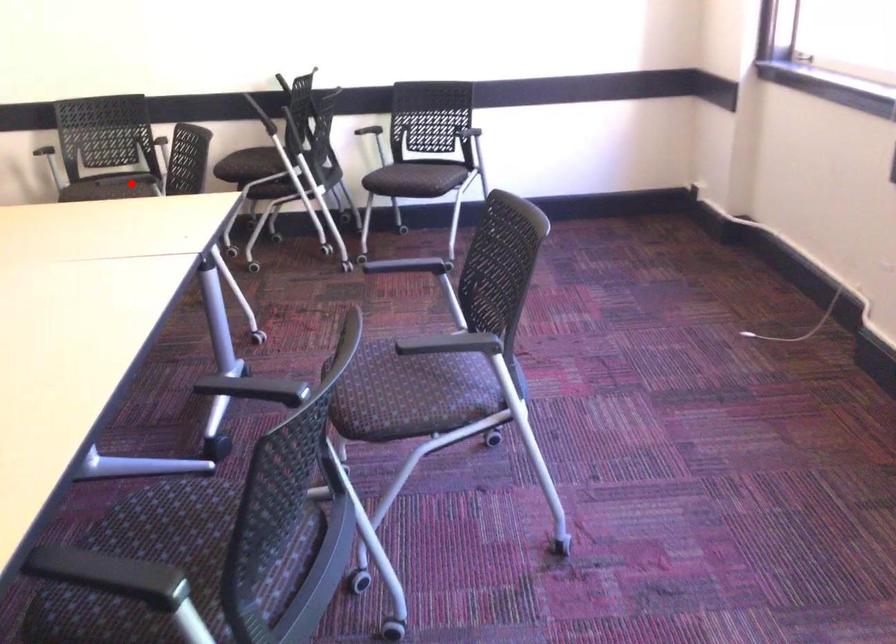
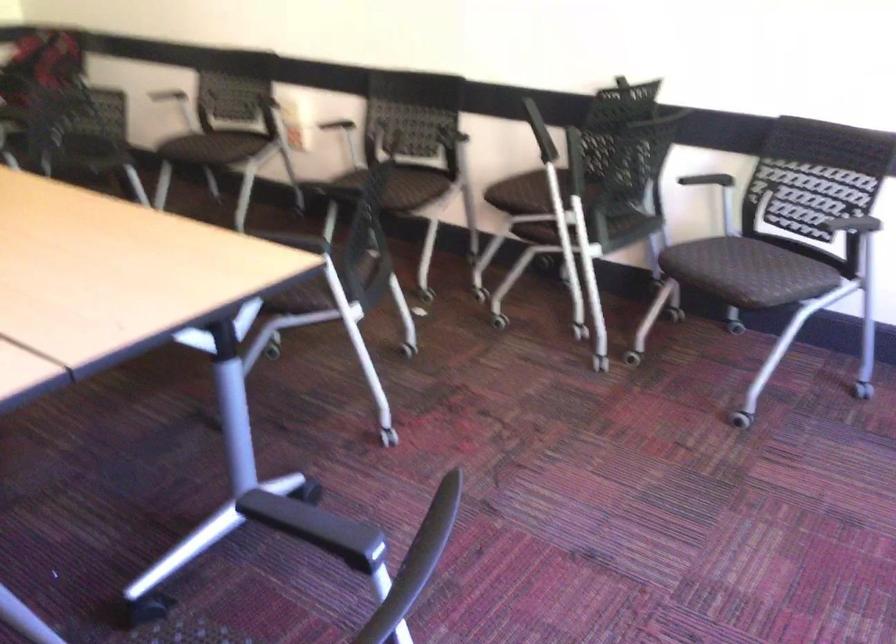
The point at the highlighted location is marked in the first image. Where is the corresponding point in the second image?

(402, 187)